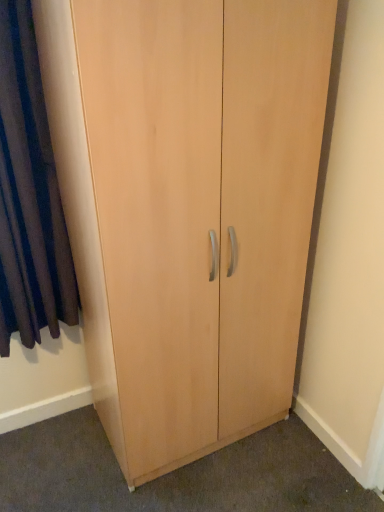
You are a GUI agent. You are given a task and a screenshot of the screen. Output one action in this format:
    pyautogui.click(x=<x>, y=<y>)
    Task: Click on the vacant space in dark blue fabric at left (from a real-world perspective)
    The width and height of the screenshot is (384, 512).
    Given the screenshot: What is the action you would take?
    pyautogui.click(x=59, y=423)